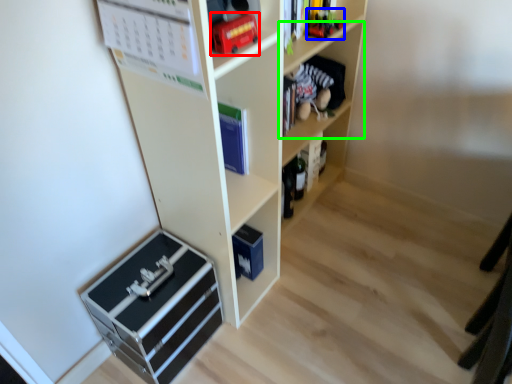
Question: Which object is the closest to the toy (highlighted by a red box)? Choose among these: toy (highlighted by a blue box) or shelf (highlighted by a green box).

Choices:
 (A) toy
 (B) shelf

Answer: (A)